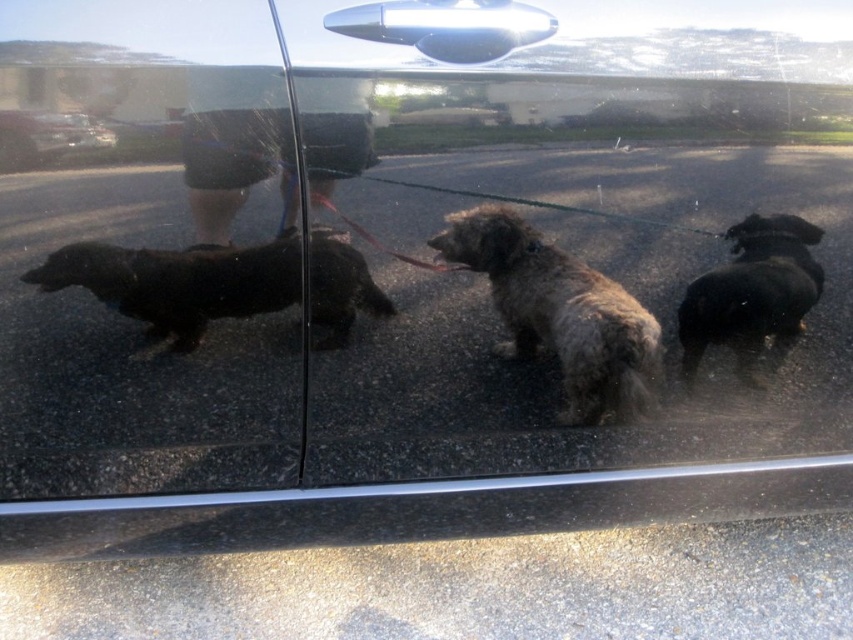
Who is more distant from viewer, (630, 376) or (177, 296)?

The point (630, 376) is behind.

Is fuzzy brown dog at center shorter than black shaggy dog at left?

In fact, fuzzy brown dog at center may be taller than black shaggy dog at left.

Locate an element on the screen. The image size is (853, 640). fuzzy brown dog at center is located at coordinates (560, 312).

Can you confirm if fuzzy brown dog at center is wider than glossy black car at upper left?

Correct, the width of fuzzy brown dog at center exceeds that of glossy black car at upper left.

Between fuzzy brown dog at center and glossy black car at upper left, which one appears on the right side from the viewer's perspective?

fuzzy brown dog at center

Is point (508, 304) farther from viewer compared to point (28, 115)?

Yes, point (508, 304) is farther from viewer.

The width and height of the screenshot is (853, 640). I want to click on fuzzy brown dog at center, so click(560, 312).

Image resolution: width=853 pixels, height=640 pixels. Describe the element at coordinates (752, 291) in the screenshot. I see `black matte dog at right` at that location.

You are a GUI agent. You are given a task and a screenshot of the screen. Output one action in this format:
    pyautogui.click(x=<x>, y=<y>)
    Task: Click on the black matte dog at right
    The width and height of the screenshot is (853, 640).
    Given the screenshot: What is the action you would take?
    pyautogui.click(x=752, y=291)